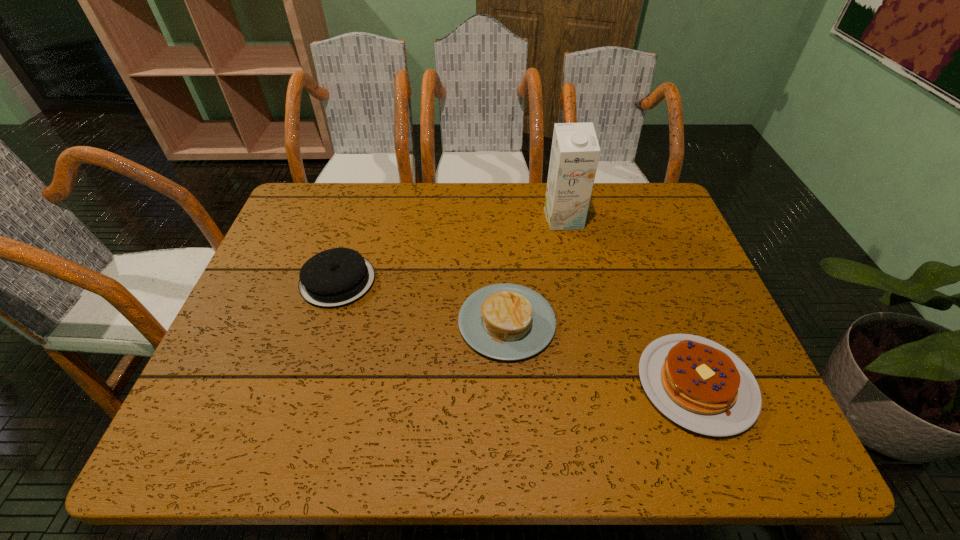
Where is `vacant space that satisfies the following two spatial constraints: 1. on the front side of the second pancake from right to left; 2. on the left side of the leftmost object`? This screenshot has width=960, height=540. vacant space that satisfies the following two spatial constraints: 1. on the front side of the second pancake from right to left; 2. on the left side of the leftmost object is located at coordinates (325, 322).

Identify the location of free space that satisfies the following two spatial constraints: 1. on the back side of the leftmost object; 2. on the left side of the third object from left to right. The height and width of the screenshot is (540, 960). (357, 219).

In order to click on vacant space that satisfies the following two spatial constraints: 1. on the front side of the leftmost pancake; 2. on the right side of the rightmost pancake in this screenshot , I will do `click(306, 384)`.

This screenshot has width=960, height=540. I want to click on free point that satisfies the following two spatial constraints: 1. on the front side of the rightmost pancake; 2. on the left side of the leftmost pancake, so click(x=306, y=384).